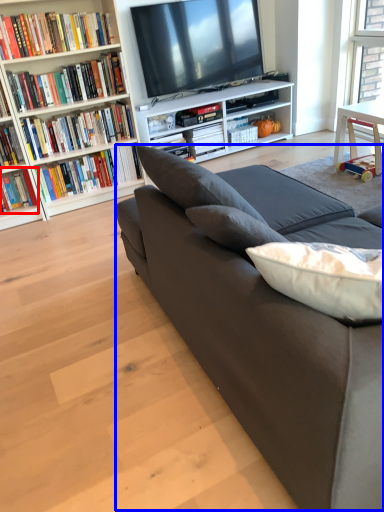
Question: Which point is closer to the camera, book (highlighted by a red box) or couch (highlighted by a blue box)?

Choices:
 (A) book
 (B) couch

Answer: (B)